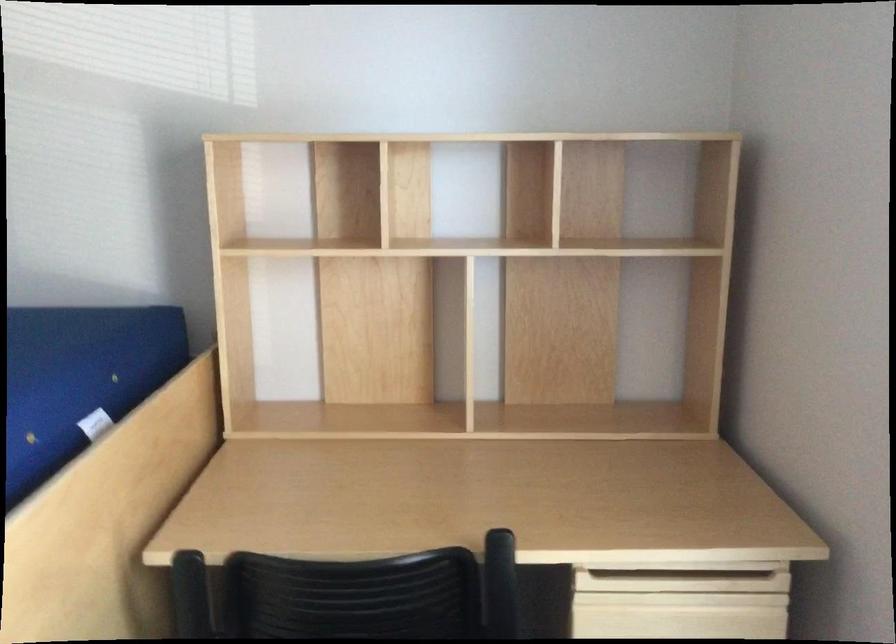
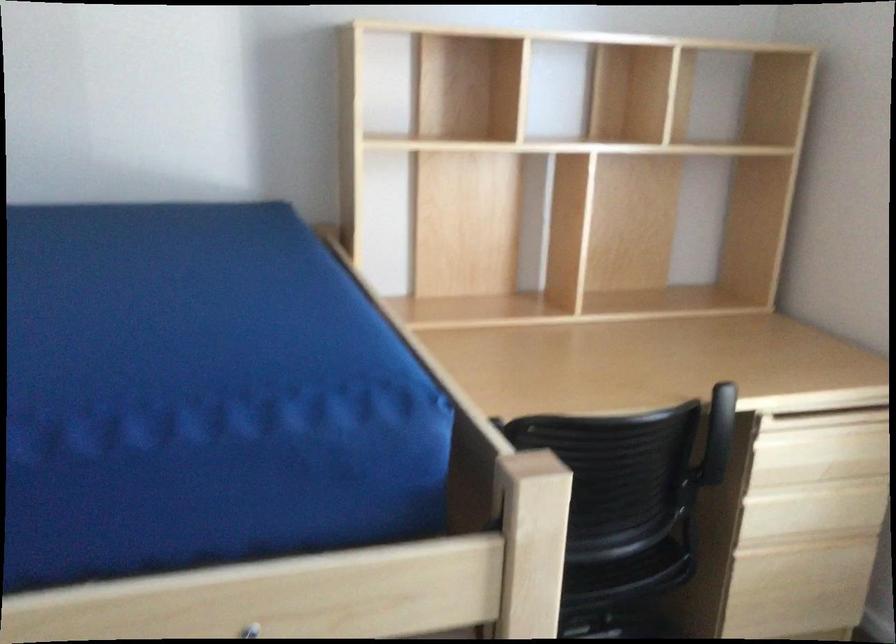
Question: Based on the continuous images, in which direction is the camera rotating? Reply with the corresponding letter.

Choices:
 (A) Left
 (B) Right
 (C) Up
 (D) Down

Answer: (B)